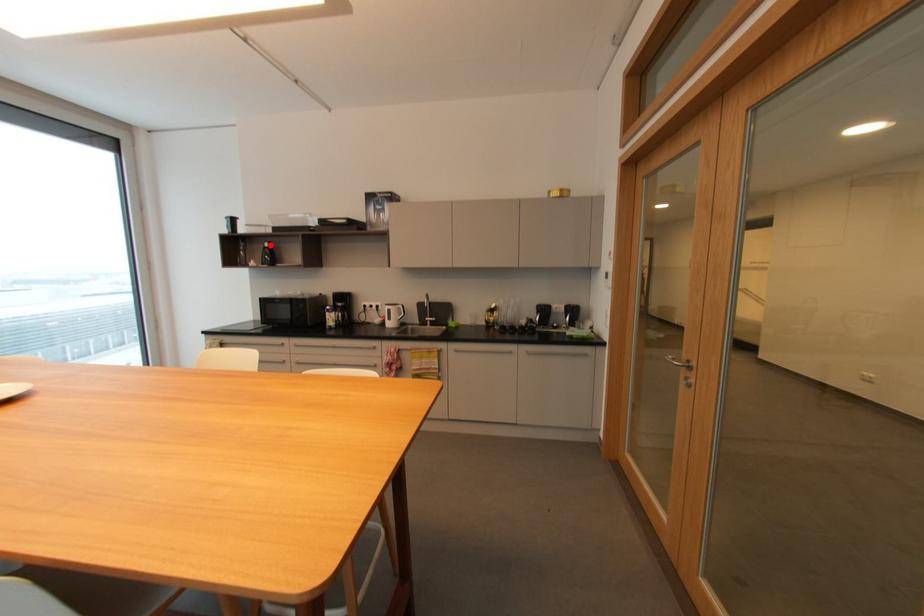
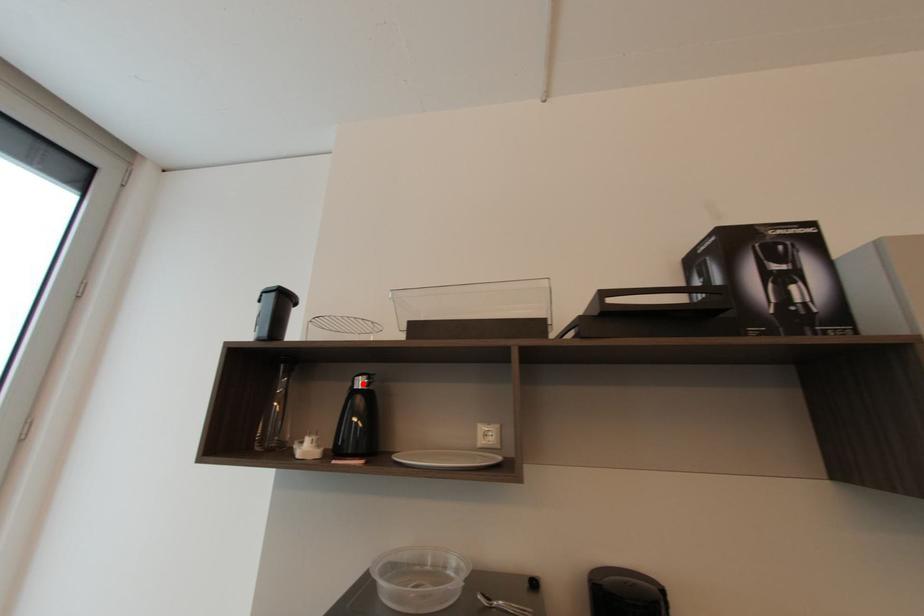
I am providing you with two images of the same scene from different viewpoints. A red point is marked on the first image and another point is marked on the second image. Does the point marked in image1 correspond to the same location as the one in image2?

Yes